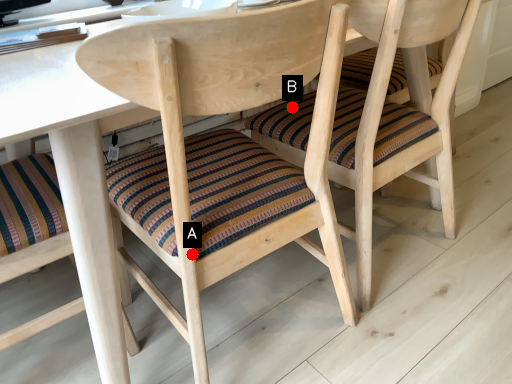
Question: Two points are circled on the image, labeled by A and B beside each circle. Which point is farther from the camera taking this photo?

Choices:
 (A) A is further
 (B) B is further

Answer: (B)